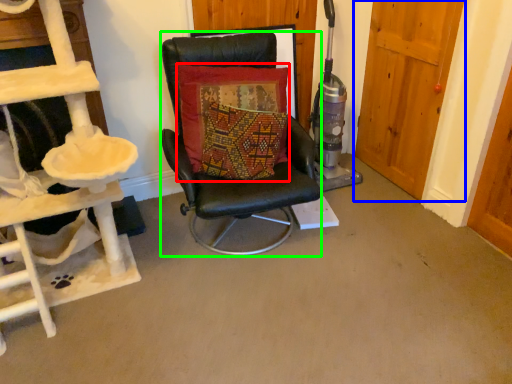
Question: Based on their relative distances, which object is farther from pillow (highlighted by a red box)? Choose from door (highlighted by a blue box) and chair (highlighted by a green box).

Choices:
 (A) door
 (B) chair

Answer: (A)